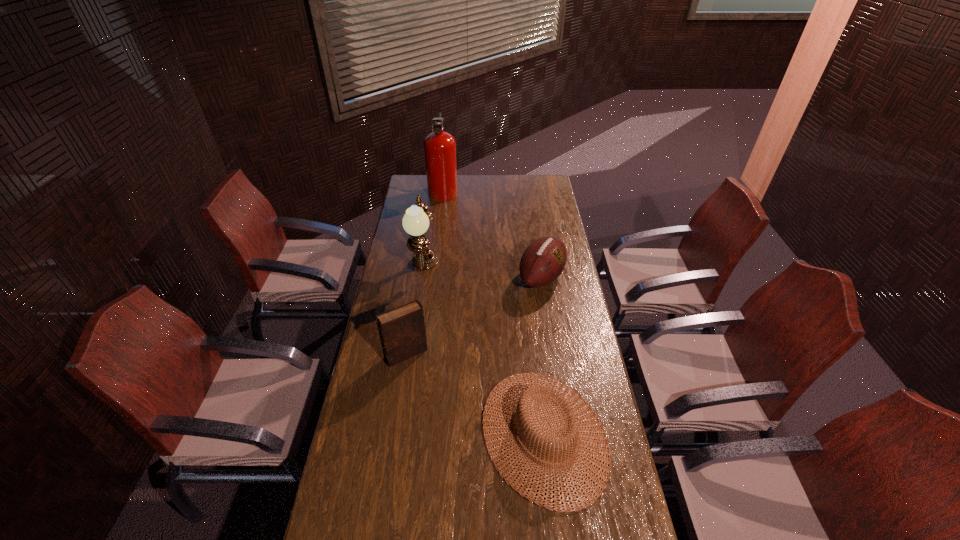
I want to click on vacant space positioned on the right of the Bible, so click(524, 354).

Where is `vacant space situated on the front of the football (American)`? Image resolution: width=960 pixels, height=540 pixels. vacant space situated on the front of the football (American) is located at coordinates (553, 353).

Locate an element on the screen. free space located on the left of the nearest object is located at coordinates (460, 434).

Locate an element on the screen. object that is at the far edge is located at coordinates (439, 146).

Where is `fire extinguisher that is positioned at the left edge`? fire extinguisher that is positioned at the left edge is located at coordinates (439, 146).

You are a GUI agent. You are given a task and a screenshot of the screen. Output one action in this format:
    pyautogui.click(x=<x>, y=<y>)
    Task: Click on the oil lamp located in the left edge section of the desktop
    The width and height of the screenshot is (960, 540).
    Given the screenshot: What is the action you would take?
    pyautogui.click(x=415, y=222)

You are a GUI agent. You are given a task and a screenshot of the screen. Output one action in this format:
    pyautogui.click(x=<x>, y=<y>)
    Task: Click on the Bible that is positioned at the left edge
    The image size is (960, 540).
    Given the screenshot: What is the action you would take?
    pyautogui.click(x=402, y=331)

I want to click on football (American) that is at the right edge, so click(x=543, y=261).

This screenshot has height=540, width=960. Find the location of `sunhat situated at the right edge`. sunhat situated at the right edge is located at coordinates (531, 392).

Find the location of `object that is at the far left corner`. object that is at the far left corner is located at coordinates (439, 146).